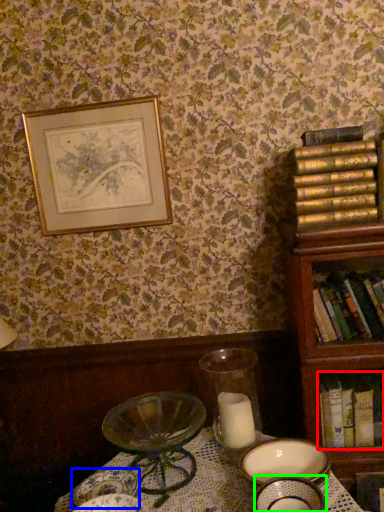
Question: Considering the real-world distances, which object is closest to book (highlighted by a red box)? tableware (highlighted by a blue box) or tableware (highlighted by a green box).

Choices:
 (A) tableware
 (B) tableware

Answer: (B)